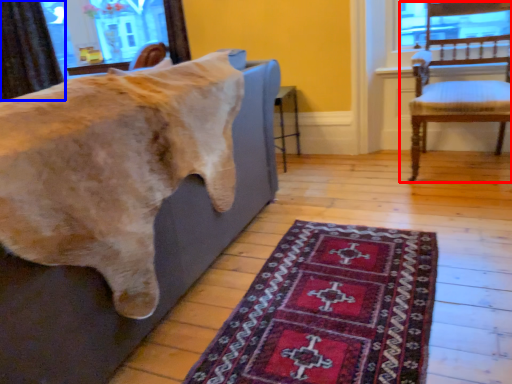
Question: Which point is further to the camera, chair (highlighted by a red box) or curtain (highlighted by a blue box)?

Choices:
 (A) chair
 (B) curtain

Answer: (B)